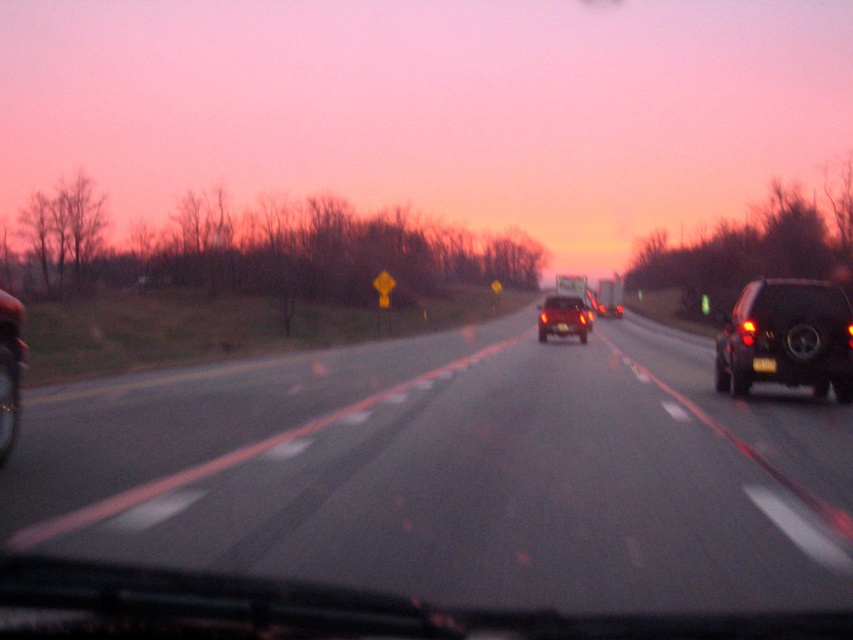
Question: Which object appears farthest from the camera in this image?

Choices:
 (A) black matte suv at right
 (B) black asphalt highway at center
 (C) black plastic license plate at right

Answer: (C)

Question: Based on their relative distances, which object is farther from the black plastic license plate at right?

Choices:
 (A) yellow matte license plate at center
 (B) black matte suv at right
 (C) matte black car at center

Answer: (C)

Question: Which object is closer to the camera taking this photo?

Choices:
 (A) black plastic license plate at right
 (B) black matte suv at right

Answer: (B)

Question: Is black matte suv at right thinner than black plastic license plate at right?

Choices:
 (A) no
 (B) yes

Answer: (A)

Question: Where is black matte suv at right located in relation to matte black car at center in the image?

Choices:
 (A) below
 (B) above

Answer: (A)

Question: Observing the image, what is the correct spatial positioning of black matte suv at right in reference to matte black car at center?

Choices:
 (A) right
 (B) left

Answer: (A)